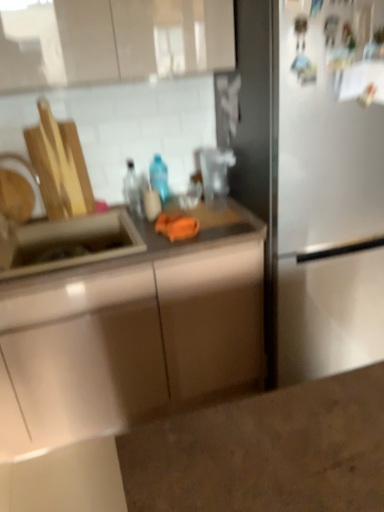
This screenshot has height=512, width=384. What do you see at coordinates (25, 177) in the screenshot? I see `brushed metal faucet at left` at bounding box center [25, 177].

This screenshot has width=384, height=512. Describe the element at coordinates (159, 177) in the screenshot. I see `translucent plastic bottle at center, marked as the first bottle in a right-to-left arrangement` at that location.

Where is `translucent plastic bottle at center, marked as the first bottle in a right-to-left arrangement`? The height and width of the screenshot is (512, 384). translucent plastic bottle at center, marked as the first bottle in a right-to-left arrangement is located at coordinates (159, 177).

From the picture: In order to face clear glass bottle at center, the 1th bottle in the left-to-right sequence, should I rotate leftwards or rightwards?

A 7.255 degree turn to the left will do.

Locate an element on the screen. Image resolution: width=384 pixels, height=512 pixels. satin white fridge at right is located at coordinates (313, 188).

Are stainless steel sink at left and satin white fridge at right located far from each other?

Actually, stainless steel sink at left and satin white fridge at right are a little close together.

From a real-world perspective, is stainless steel sink at left above or below satin white fridge at right?

stainless steel sink at left is below satin white fridge at right.

Does stainless steel sink at left have a greater height compared to satin white fridge at right?

No.

Does stainless steel sink at left have a greater width compared to satin white fridge at right?

No, stainless steel sink at left is not wider than satin white fridge at right.

In the scene shown: Considering the positions of objects translucent plastic bottle at center, marked as the 2th bottle in a left-to-right arrangement, and satin white fridge at right in the image provided, who is in front, translucent plastic bottle at center, marked as the 2th bottle in a left-to-right arrangement, or satin white fridge at right?

Positioned in front is satin white fridge at right.

Which is in front, point (162, 167) or point (354, 160)?

Positioned in front is point (354, 160).

Considering the sizes of translucent plastic bottle at center, marked as the first bottle in a right-to-left arrangement, and satin white fridge at right in the image, is translucent plastic bottle at center, marked as the first bottle in a right-to-left arrangement, taller or shorter than satin white fridge at right?

translucent plastic bottle at center, marked as the first bottle in a right-to-left arrangement, is shorter than satin white fridge at right.

From the image's perspective, between matte stainless steel sink at left and stainless steel sink at left, which one is located above?

matte stainless steel sink at left is shown above in the image.

Where is `countertop lying in front of the matte stainless steel sink at left`? This screenshot has width=384, height=512. countertop lying in front of the matte stainless steel sink at left is located at coordinates (123, 355).

Is matte stainless steel sink at left turned away from stainless steel sink at left?

Yes, stainless steel sink at left is at the back of matte stainless steel sink at left.

Is matte stainless steel sink at left positioned far away from stainless steel sink at left?

That's not correct — matte stainless steel sink at left is a little close to stainless steel sink at left.

How much distance is there between translucent plastic bottle at center, marked as the first bottle in a right-to-left arrangement, and matte stainless steel sink at left?

They are 18.88 inches apart.

Which of these two, translucent plastic bottle at center, marked as the first bottle in a right-to-left arrangement, or matte stainless steel sink at left, stands taller?

translucent plastic bottle at center, marked as the first bottle in a right-to-left arrangement, is taller.

From a real-world perspective, relative to matte stainless steel sink at left, is translucent plastic bottle at center, marked as the 2th bottle in a left-to-right arrangement, vertically above or below?

In terms of real-world spatial position, translucent plastic bottle at center, marked as the 2th bottle in a left-to-right arrangement, is above matte stainless steel sink at left.

Identify the location of the 2nd bottle above the matte stainless steel sink at left (from a real-world perspective). This screenshot has width=384, height=512. (159, 177).

In order to click on countertop on the left of the clear glass bottle at center, the 1th bottle in the left-to-right sequence in this screenshot , I will do `click(123, 355)`.

Is clear glass bottle at center, the 1th bottle in the left-to-right sequence, wider than stainless steel sink at left?

No.

Looking at this image, is clear glass bottle at center, the 1th bottle in the left-to-right sequence, aimed at stainless steel sink at left?

No, clear glass bottle at center, the 1th bottle in the left-to-right sequence, is not aimed at stainless steel sink at left.

Can you tell me how much satin white fridge at right and brushed metal faucet at left differ in facing direction?

The angle between the facing direction of satin white fridge at right and the facing direction of brushed metal faucet at left is 0.00318 degrees.

Does satin white fridge at right touch brushed metal faucet at left?

satin white fridge at right is not next to brushed metal faucet at left, and they're not touching.

In terms of width, does satin white fridge at right look wider or thinner when compared to brushed metal faucet at left?

In the image, satin white fridge at right appears to be wider than brushed metal faucet at left.

Where is `faucet lying behind the satin white fridge at right`? Image resolution: width=384 pixels, height=512 pixels. faucet lying behind the satin white fridge at right is located at coordinates (25, 177).

Based on the photo, is the position of brushed metal faucet at left more distant than that of stainless steel sink at left?

Yes, brushed metal faucet at left is further from the camera.

From a real-world perspective, which is physically above, brushed metal faucet at left or stainless steel sink at left?

brushed metal faucet at left, from a real-world perspective.

From the image's perspective, which is above, brushed metal faucet at left or stainless steel sink at left?

From the image's view, brushed metal faucet at left is above.

The image size is (384, 512). What are the coordinates of `fridge above the stainless steel sink at left (from the image's perspective)` in the screenshot? It's located at (313, 188).

Where is `fridge below the translucent plastic bottle at center, marked as the 2th bottle in a left-to-right arrangement (from the image's perspective)`? This screenshot has height=512, width=384. fridge below the translucent plastic bottle at center, marked as the 2th bottle in a left-to-right arrangement (from the image's perspective) is located at coordinates (313, 188).

Looking at the image, which one is located closer to stainless steel sink at left, matte stainless steel sink at left or satin white fridge at right?

matte stainless steel sink at left is closer to stainless steel sink at left.

When comparing their distances from clear glass bottle at center, the 1th bottle in the left-to-right sequence, does translucent plastic bottle at center, marked as the first bottle in a right-to-left arrangement, or brushed metal faucet at left seem further?

Based on the image, brushed metal faucet at left appears to be further to clear glass bottle at center, the 1th bottle in the left-to-right sequence.

Based on their spatial positions, is satin white fridge at right or brushed metal faucet at left closer to translucent plastic bottle at center, marked as the 2th bottle in a left-to-right arrangement?

brushed metal faucet at left lies closer to translucent plastic bottle at center, marked as the 2th bottle in a left-to-right arrangement, than the other object.

When comparing their distances from matte stainless steel sink at left, does translucent plastic bottle at center, marked as the first bottle in a right-to-left arrangement, or satin white fridge at right seem closer?

Based on the image, translucent plastic bottle at center, marked as the first bottle in a right-to-left arrangement, appears to be nearer to matte stainless steel sink at left.

Estimate the real-world distances between objects in this image. Which object is closer to satin white fridge at right, translucent plastic bottle at center, marked as the first bottle in a right-to-left arrangement, or clear glass bottle at center, which appears as the second bottle when viewed from the right?

translucent plastic bottle at center, marked as the first bottle in a right-to-left arrangement, is closer to satin white fridge at right.

Considering their positions, is translucent plastic bottle at center, marked as the first bottle in a right-to-left arrangement, positioned closer to matte stainless steel sink at left than clear glass bottle at center, which appears as the second bottle when viewed from the right?

Among the two, clear glass bottle at center, which appears as the second bottle when viewed from the right, is located nearer to matte stainless steel sink at left.

From the picture: Which object lies further to the anchor point brushed metal faucet at left, clear glass bottle at center, the 1th bottle in the left-to-right sequence, or satin white fridge at right?

satin white fridge at right is further to brushed metal faucet at left.

Looking at the image, which one is located further to satin white fridge at right, brushed metal faucet at left or clear glass bottle at center, the 1th bottle in the left-to-right sequence?

Based on the image, brushed metal faucet at left appears to be further to satin white fridge at right.

The image size is (384, 512). What are the coordinates of `bottle between clear glass bottle at center, the 1th bottle in the left-to-right sequence, and satin white fridge at right from left to right` in the screenshot? It's located at (159, 177).

What are the coordinates of `sink located between brushed metal faucet at left and translucent plastic bottle at center, marked as the 2th bottle in a left-to-right arrangement, in the left-right direction` in the screenshot? It's located at (67, 243).

The image size is (384, 512). Identify the location of sink that lies between clear glass bottle at center, which appears as the second bottle when viewed from the right, and stainless steel sink at left from top to bottom. (67, 243).

In order to click on sink between translucent plastic bottle at center, marked as the first bottle in a right-to-left arrangement, and stainless steel sink at left from top to bottom in this screenshot , I will do `click(67, 243)`.